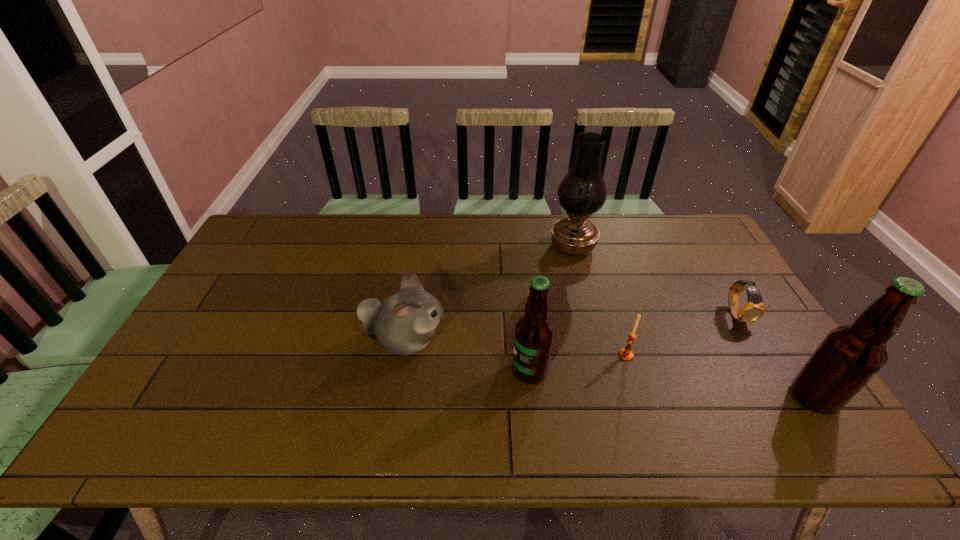
You are a GUI agent. You are given a task and a screenshot of the screen. Output one action in this format:
    pyautogui.click(x=<x>, y=<y>)
    Task: Click on the third tallest object
    The width and height of the screenshot is (960, 540).
    Given the screenshot: What is the action you would take?
    pyautogui.click(x=534, y=332)

You are a GUI agent. You are given a task and a screenshot of the screen. Output one action in this format:
    pyautogui.click(x=<x>, y=<y>)
    Task: Click on the shorter beer bottle
    
    Given the screenshot: What is the action you would take?
    pyautogui.click(x=534, y=332)

Identify the location of the right beer bottle. (849, 357).

Find the location of a particular element. oil lamp is located at coordinates (582, 192).

Locate an element on the screen. This screenshot has height=540, width=960. candle_holder is located at coordinates (626, 354).

Find the location of a particular element. watch is located at coordinates (754, 309).

The width and height of the screenshot is (960, 540). What are the coordinates of `hamster` in the screenshot? It's located at (403, 323).

At what (x,y) coordinates should I click in order to perform the action: click on the fourth tallest object. Please return your answer as a coordinate pair (x, y). The height and width of the screenshot is (540, 960). Looking at the image, I should click on (403, 323).

You are a GUI agent. You are given a task and a screenshot of the screen. Output one action in this format:
    pyautogui.click(x=<x>, y=<y>)
    Task: Click on the vacant point located on the label of the second object from left to right
    Image resolution: width=960 pixels, height=540 pixels.
    Given the screenshot: What is the action you would take?
    pyautogui.click(x=391, y=371)

Locate an element on the screen. The width and height of the screenshot is (960, 540). free region located 0.280m on the label of the second object from left to right is located at coordinates (402, 371).